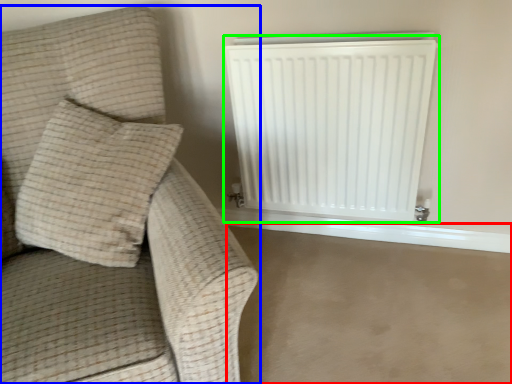
Question: Which is farther away from concrete (highlighted by a red box)? furniture (highlighted by a blue box) or radiator (highlighted by a green box)?

Choices:
 (A) furniture
 (B) radiator

Answer: (A)